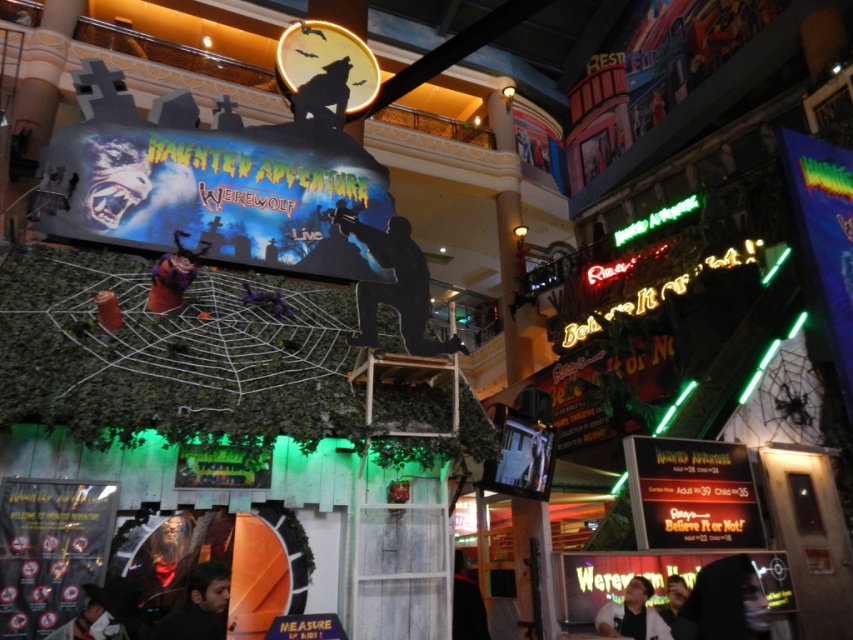
You are a visitor at the Haunted Adventure attraction and want to take a photo with the main decorations. The decorations include the black matte silhouette at center and the black fabric person at center. Which decoration should you stand closer to if you want both to appear in your photo without moving the camera?

You should stand closer to the black fabric person at center because the black matte silhouette at center is above it, so positioning yourself closer to the lower object allows both to be in frame without moving the camera.

You are standing in front of the Haunted Adventure Werewolf sign at the mall. There are two points marked on the sign. The first point is at coordinates point (393,224) and the second is at point (679,609). If you want to touch the closest point to you on the sign, which coordinate should you aim for?

The point at (393,224) is closer to the camera, so you should aim for point (393,224) to touch the closest point on the sign.